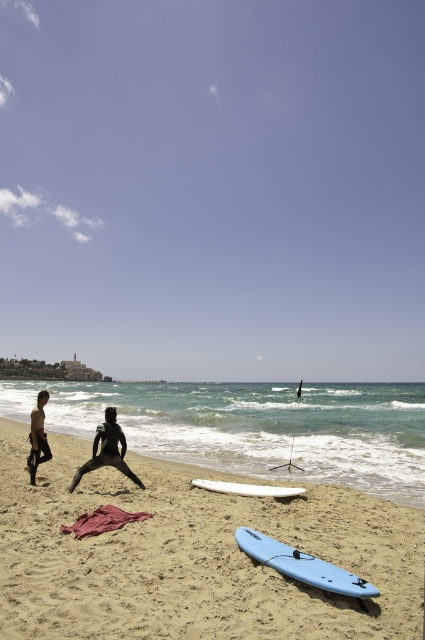
Question: Which point is farther to the camera?

Choices:
 (A) black matte wetsuit at center
 (B) white matte surfboard at center
 (C) matte black wetsuit at center
 (D) light blue plastic surfboard at lower center

Answer: (C)

Question: Which object is positioned farthest from the matte black wetsuit at center?

Choices:
 (A) smooth sand at center
 (B) white matte surfboard at center

Answer: (B)

Question: Is the position of light blue plastic surfboard at lower center less distant than that of white matte surfboard at center?

Choices:
 (A) no
 (B) yes

Answer: (B)

Question: Does light blue plastic surfboard at lower center have a smaller size compared to matte black wetsuit at center?

Choices:
 (A) yes
 (B) no

Answer: (A)

Question: Which point is closer to the camera?

Choices:
 (A) (282, 490)
 (B) (79, 477)
 (C) (342, 612)
 (D) (44, 456)

Answer: (C)

Question: Where is smooth sand at center located in relation to black matte wetsuit at center in the image?

Choices:
 (A) right
 (B) left

Answer: (A)